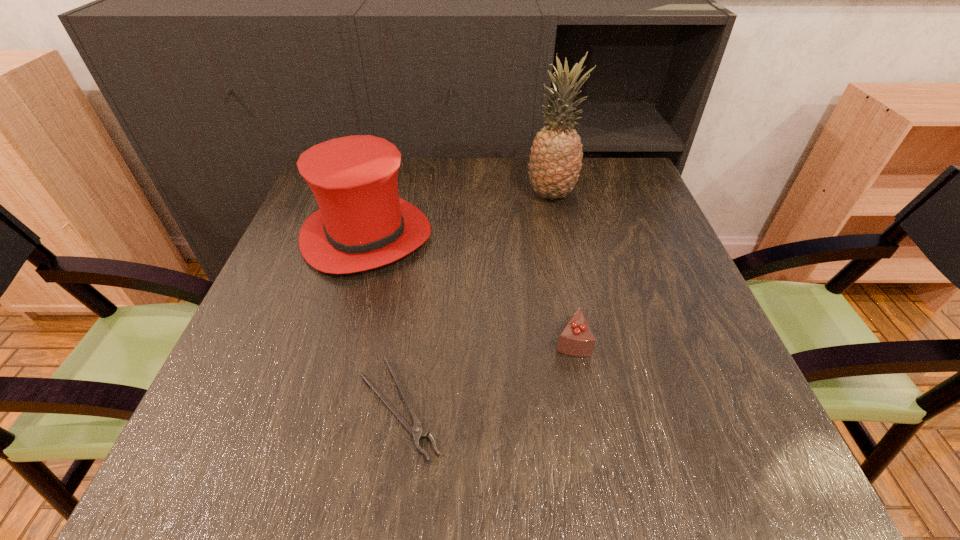
This screenshot has width=960, height=540. In order to click on pineapple present at the far edge in this screenshot , I will do `click(555, 162)`.

Find the location of `hat that is positioned at the far edge`. hat that is positioned at the far edge is located at coordinates (362, 223).

This screenshot has width=960, height=540. I want to click on object that is at the near edge, so coord(416,431).

Locate an element on the screen. object positioned at the left edge is located at coordinates (362, 223).

Where is `object located at the far left corner`? The height and width of the screenshot is (540, 960). object located at the far left corner is located at coordinates tap(362, 223).

At what (x,y) coordinates should I click in order to perform the action: click on free space at the far edge of the desktop. Please return your answer as a coordinate pair (x, y). The image size is (960, 540). Looking at the image, I should click on (486, 162).

The image size is (960, 540). Identify the location of vacant space at the near edge of the desktop. (305, 488).

Where is `vacant area at the left edge of the desktop`? vacant area at the left edge of the desktop is located at coordinates (259, 388).

Locate an element on the screen. The width and height of the screenshot is (960, 540). free space at the right edge of the desktop is located at coordinates (695, 296).

The image size is (960, 540). Find the location of `vacant space at the far right corner of the desktop`. vacant space at the far right corner of the desktop is located at coordinates (603, 158).